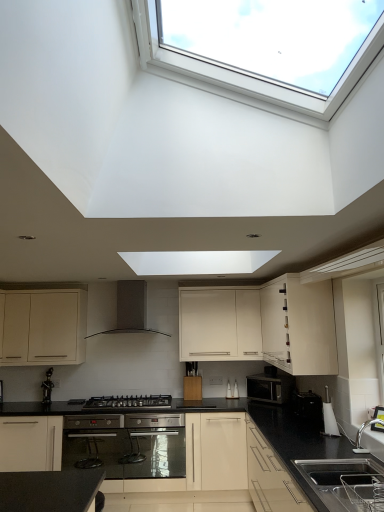
This screenshot has height=512, width=384. What are the coordinates of `vacant region to the left of white plastic kettle at lower right, the third appliance viewed from the back` in the screenshot? It's located at (316, 434).